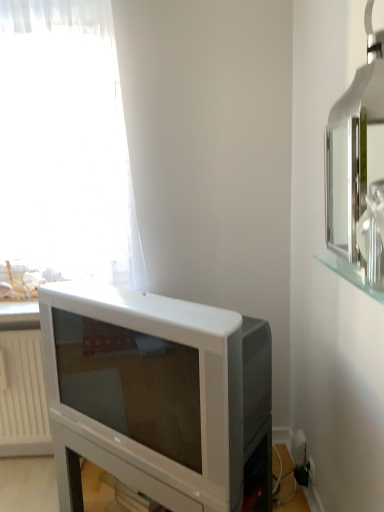
This screenshot has height=512, width=384. What are the coordinates of `white sheer curtain at upper left` in the screenshot? It's located at (65, 145).

Where is `white plastic radiator at lower left`? The height and width of the screenshot is (512, 384). white plastic radiator at lower left is located at coordinates (23, 396).

Which of these two, white sheer curtain at upper left or silver metallic medicine cabinet at upper right, is wider?

With larger width is white sheer curtain at upper left.

From the picture: How different are the orientations of white sheer curtain at upper left and silver metallic medicine cabinet at upper right in degrees?

The facing directions of white sheer curtain at upper left and silver metallic medicine cabinet at upper right are 88.8 degrees apart.

Looking at this image, from a real-world perspective, which is physically below, white sheer curtain at upper left or silver metallic medicine cabinet at upper right?

In real-world perspective, silver metallic medicine cabinet at upper right is lower.

Is white sheer curtain at upper left to the left of silver metallic medicine cabinet at upper right from the viewer's perspective?

Yes, white sheer curtain at upper left is to the left of silver metallic medicine cabinet at upper right.

From a real-world perspective, between white plastic radiator at lower left and silver metallic medicine cabinet at upper right, who is vertically lower?

In real-world perspective, white plastic radiator at lower left is lower.

Which is in front, white plastic radiator at lower left or silver metallic medicine cabinet at upper right?

Positioned in front is silver metallic medicine cabinet at upper right.

Can you confirm if white plastic radiator at lower left is shorter than silver metallic medicine cabinet at upper right?

No.

From the image's perspective, does white plastic radiator at lower left appear lower than silver metallic medicine cabinet at upper right?

Yes.

Does white plastic radiator at lower left appear on the left side of white sheer curtain at upper left?

Correct, you'll find white plastic radiator at lower left to the left of white sheer curtain at upper left.

Would you consider white plastic radiator at lower left to be distant from white sheer curtain at upper left?

No, white plastic radiator at lower left is not far from white sheer curtain at upper left.

Considering the sizes of objects white plastic radiator at lower left and white sheer curtain at upper left in the image provided, who is shorter, white plastic radiator at lower left or white sheer curtain at upper left?

With less height is white plastic radiator at lower left.

From the image's perspective, is white plastic radiator at lower left located above white sheer curtain at upper left?

Actually, white plastic radiator at lower left appears below white sheer curtain at upper left in the image.

Is silver metallic medicine cabinet at upper right oriented away from white plastic radiator at lower left?

silver metallic medicine cabinet at upper right does not have its back to white plastic radiator at lower left.

Between silver metallic medicine cabinet at upper right and white plastic radiator at lower left, which one has less height?

silver metallic medicine cabinet at upper right is shorter.

In order to click on medicine cabinet located in front of the white plastic radiator at lower left in this screenshot , I will do `click(353, 163)`.

Is silver metallic medicine cabinet at upper right not within white plastic radiator at lower left?

Yes, silver metallic medicine cabinet at upper right is not within white plastic radiator at lower left.

Is silver metallic medicine cabinet at upper right at the back of white plastic television at lower left?

No, white plastic television at lower left's orientation is not away from silver metallic medicine cabinet at upper right.

Is white plastic television at lower left placed right next to silver metallic medicine cabinet at upper right?

No, white plastic television at lower left is not touching silver metallic medicine cabinet at upper right.

Is white plastic television at lower left to the right of silver metallic medicine cabinet at upper right from the viewer's perspective?

No, white plastic television at lower left is not to the right of silver metallic medicine cabinet at upper right.

Image resolution: width=384 pixels, height=512 pixels. I want to click on curtain that appears above the white plastic radiator at lower left (from the image's perspective), so click(65, 145).

Does white sheer curtain at upper left touch white plastic radiator at lower left?

white sheer curtain at upper left is not next to white plastic radiator at lower left, and they're not touching.

Is white sheer curtain at upper left spatially inside white plastic radiator at lower left, or outside of it?

The correct answer is: outside.

From a real-world perspective, who is located higher, white plastic radiator at lower left or white plastic television at lower left?

white plastic television at lower left.

Is white plastic radiator at lower left far away from white plastic television at lower left?

They are positioned close to each other.

Can you tell me how much white plastic radiator at lower left and white plastic television at lower left differ in facing direction?

There is a 37.5-degree angle between the facing directions of white plastic radiator at lower left and white plastic television at lower left.

From their relative heights in the image, would you say white plastic radiator at lower left is taller or shorter than white plastic television at lower left?

Considering their sizes, white plastic radiator at lower left has more height than white plastic television at lower left.

Image resolution: width=384 pixels, height=512 pixels. I want to click on medicine cabinet below the white sheer curtain at upper left (from the image's perspective), so click(353, 163).

This screenshot has height=512, width=384. I want to click on medicine cabinet that appears above the white plastic radiator at lower left (from the image's perspective), so click(x=353, y=163).

Looking at the image, which one is located closer to white sheer curtain at upper left, silver metallic medicine cabinet at upper right or white plastic radiator at lower left?

The object closer to white sheer curtain at upper left is white plastic radiator at lower left.

Which object lies nearer to the anchor point silver metallic medicine cabinet at upper right, white plastic radiator at lower left or white sheer curtain at upper left?

white sheer curtain at upper left.

From the image, which object appears to be nearer to silver metallic medicine cabinet at upper right, white plastic television at lower left or white plastic radiator at lower left?

white plastic television at lower left lies closer to silver metallic medicine cabinet at upper right than the other object.

Estimate the real-world distances between objects in this image. Which object is closer to white plastic radiator at lower left, white sheer curtain at upper left or silver metallic medicine cabinet at upper right?

white sheer curtain at upper left.

Looking at the image, which one is located further to white plastic radiator at lower left, silver metallic medicine cabinet at upper right or white sheer curtain at upper left?

silver metallic medicine cabinet at upper right lies further to white plastic radiator at lower left than the other object.

Which object lies nearer to the anchor point white sheer curtain at upper left, silver metallic medicine cabinet at upper right or white plastic television at lower left?

white plastic television at lower left is closer to white sheer curtain at upper left.

Based on their spatial positions, is silver metallic medicine cabinet at upper right or white plastic radiator at lower left closer to white plastic television at lower left?

Based on the image, white plastic radiator at lower left appears to be nearer to white plastic television at lower left.

Which object lies nearer to the anchor point white plastic television at lower left, silver metallic medicine cabinet at upper right or white sheer curtain at upper left?

white sheer curtain at upper left lies closer to white plastic television at lower left than the other object.

At what (x,y) coordinates should I click in order to perform the action: click on curtain between silver metallic medicine cabinet at upper right and white plastic radiator at lower left from front to back. Please return your answer as a coordinate pair (x, y). Looking at the image, I should click on click(65, 145).

Locate an element on the screen. This screenshot has width=384, height=512. television located between silver metallic medicine cabinet at upper right and white plastic radiator at lower left in the depth direction is located at coordinates (157, 396).

Where is `television between white sheer curtain at upper left and white plastic radiator at lower left from top to bottom`? The height and width of the screenshot is (512, 384). television between white sheer curtain at upper left and white plastic radiator at lower left from top to bottom is located at coordinates (157, 396).

The image size is (384, 512). Find the location of `television situated between white sheer curtain at upper left and silver metallic medicine cabinet at upper right from left to right`. television situated between white sheer curtain at upper left and silver metallic medicine cabinet at upper right from left to right is located at coordinates (157, 396).